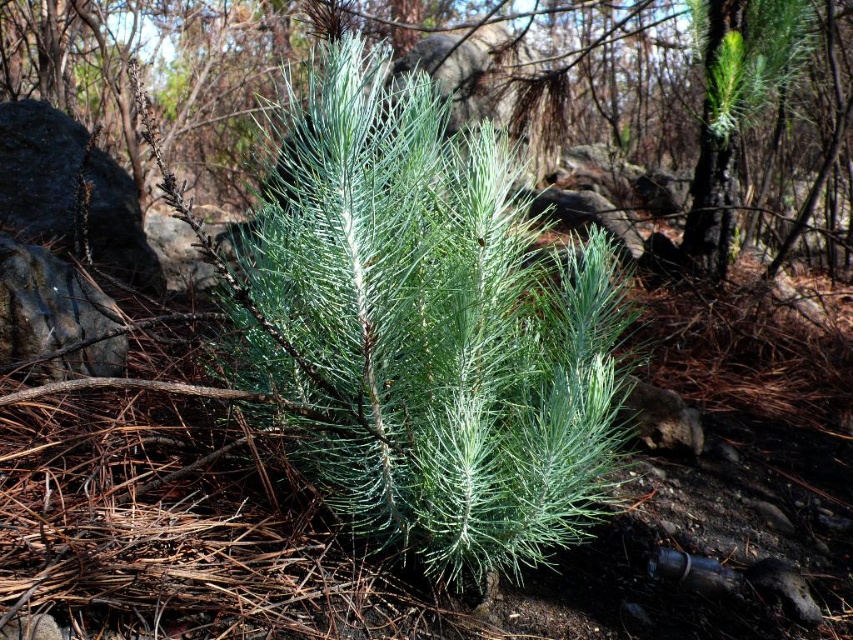
Is green needle-like plant at center positioned in front of green needle-like plant at upper right?

No, green needle-like plant at center is behind green needle-like plant at upper right.

Can you confirm if green needle-like plant at center is wider than green needle-like plant at upper right?

Incorrect, green needle-like plant at center's width does not surpass green needle-like plant at upper right's.

Is point (675, 161) less distant than point (730, 68)?

No, (675, 161) is further to viewer.

Locate an element on the screen. green needle-like plant at center is located at coordinates (152, 67).